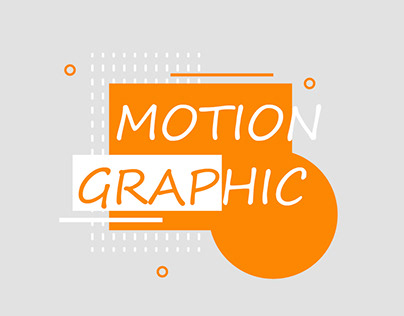
Where is `box`? box is located at coordinates (190, 167).